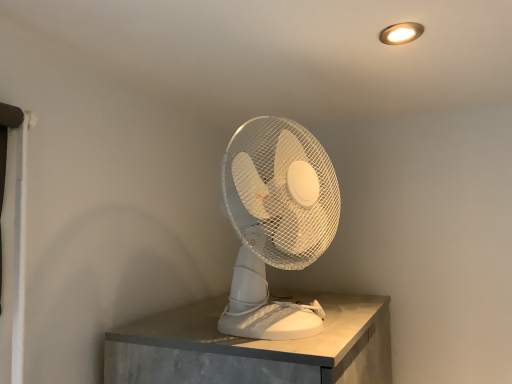
Question: From a real-world perspective, is white plastic fan at center positioned over matte gold light fixture at upper right based on gravity?

Choices:
 (A) no
 (B) yes

Answer: (A)

Question: Is white plastic fan at center positioned behind matte gold light fixture at upper right?

Choices:
 (A) no
 (B) yes

Answer: (A)

Question: Is white plastic fan at center positioned beyond the bounds of matte gold light fixture at upper right?

Choices:
 (A) yes
 (B) no

Answer: (A)

Question: Is white plastic fan at center positioned with its back to matte gold light fixture at upper right?

Choices:
 (A) no
 (B) yes

Answer: (A)

Question: Can you confirm if white plastic fan at center is smaller than matte gold light fixture at upper right?

Choices:
 (A) yes
 (B) no

Answer: (B)

Question: Is matte gold light fixture at upper right surrounded by white plastic fan at center?

Choices:
 (A) no
 (B) yes

Answer: (A)

Question: Can you confirm if matte gold light fixture at upper right is wider than white plastic fan at center?

Choices:
 (A) no
 (B) yes

Answer: (A)

Question: Is white plastic fan at center inside matte gold light fixture at upper right?

Choices:
 (A) no
 (B) yes

Answer: (A)

Question: Can you confirm if matte gold light fixture at upper right is positioned to the right of white plastic fan at center?

Choices:
 (A) no
 (B) yes

Answer: (B)

Question: From a real-world perspective, is matte gold light fixture at upper right beneath white plastic fan at center?

Choices:
 (A) yes
 (B) no

Answer: (B)

Question: Does matte gold light fixture at upper right have a lesser width compared to white plastic fan at center?

Choices:
 (A) yes
 (B) no

Answer: (A)

Question: Are matte gold light fixture at upper right and white plastic fan at center far apart?

Choices:
 (A) no
 (B) yes

Answer: (A)

Question: In the image, is white plastic fan at center positioned in front of or behind matte gold light fixture at upper right?

Choices:
 (A) behind
 (B) front

Answer: (B)